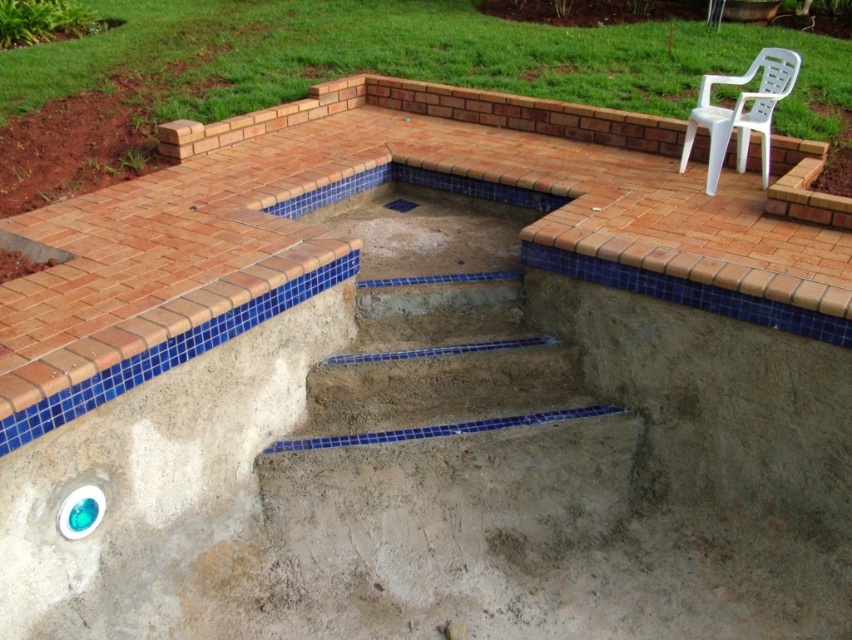
You are a contractor inspecting the pool area. You need to install a safety railing on the side where the concrete steps at center are located. Which side of the blue mosaic tiles at center should you place the railing?

The concrete steps at center are positioned on the left side of the blue mosaic tiles at center, so you should place the safety railing on the left side of the blue mosaic tiles at center.

You are planning to place a new bench in the backyard scene. The bench needs to be positioned above the blue mosaic tiles at center but must avoid the white plastic chair at upper right. Where should you place the bench?

The bench should be placed above the blue mosaic tiles at center but below the white plastic chair at upper right since the blue mosaic tiles at center is located below the white plastic chair at upper right.